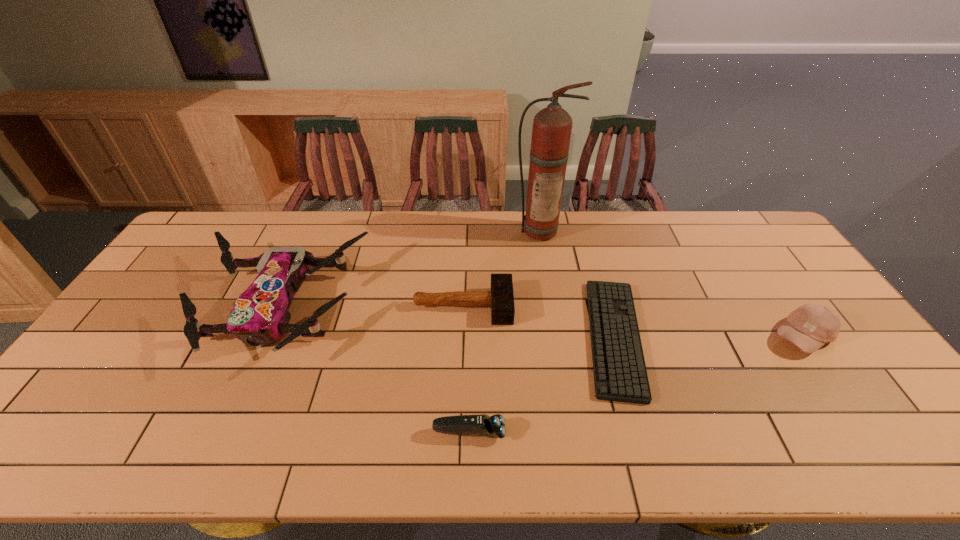
Where is `the farthest object`? the farthest object is located at coordinates tap(552, 126).

Identify the location of fire extinguisher. (552, 126).

Where is `the leftmost object`? This screenshot has height=540, width=960. the leftmost object is located at coordinates (260, 315).

At what (x,y) coordinates should I click in order to perform the action: click on the second tallest object. Please return your answer as a coordinate pair (x, y). The image size is (960, 540). Looking at the image, I should click on (260, 315).

At what (x,y) coordinates should I click in order to perform the action: click on the rightmost object. Please return your answer as a coordinate pair (x, y). The width and height of the screenshot is (960, 540). Looking at the image, I should click on (809, 327).

Identify the location of baseball cap. The height and width of the screenshot is (540, 960). (809, 327).

Locate an element on the screen. This screenshot has width=960, height=540. mallet is located at coordinates (501, 297).

Find the location of a particular element. Image resolution: width=960 pixels, height=540 pixels. the nearest object is located at coordinates (492, 426).

Where is `the shortest object`? The image size is (960, 540). the shortest object is located at coordinates (619, 368).

Where is `free space located on the side of the tallest object with the label and nozzle`? free space located on the side of the tallest object with the label and nozzle is located at coordinates (555, 323).